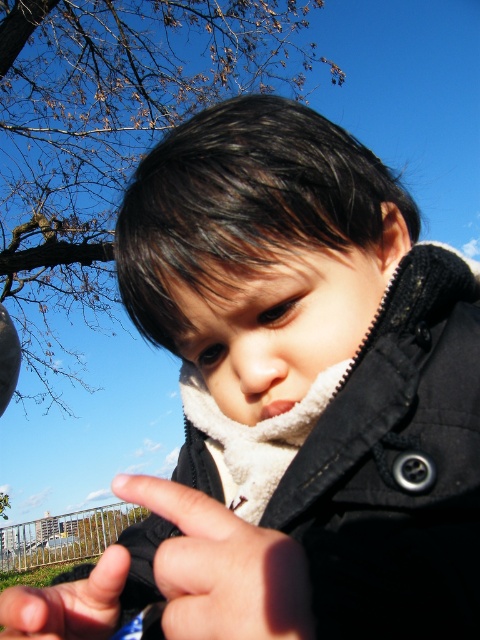
Question: In this image, where is smooth black glove at center located relative to smooth black hand at center?

Choices:
 (A) right
 (B) left

Answer: (A)

Question: Does smooth black glove at center appear over smooth black hand at center?

Choices:
 (A) no
 (B) yes

Answer: (B)

Question: Is smooth black glove at center positioned in front of smooth black hand at center?

Choices:
 (A) no
 (B) yes

Answer: (B)